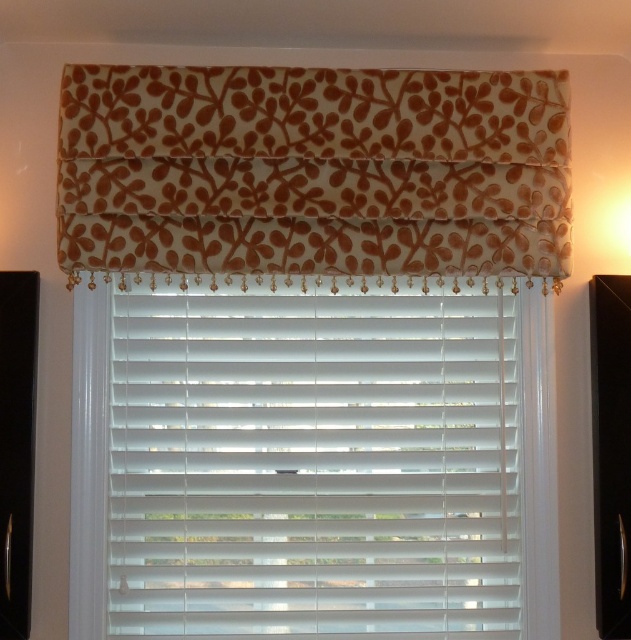
Question: From the image, what is the correct spatial relationship of white matte blinds at center in relation to brown floral fabric valance at upper center?

Choices:
 (A) right
 (B) left

Answer: (A)

Question: Does white matte blinds at center have a larger size compared to brown floral fabric valance at upper center?

Choices:
 (A) yes
 (B) no

Answer: (A)

Question: Which point is farther to the camera?

Choices:
 (A) (430, 150)
 (B) (451, 444)

Answer: (B)

Question: Which object is farther from the camera taking this photo?

Choices:
 (A) brown floral fabric valance at upper center
 (B) white matte blinds at center

Answer: (B)

Question: Does white matte blinds at center appear over brown floral fabric valance at upper center?

Choices:
 (A) yes
 (B) no

Answer: (B)